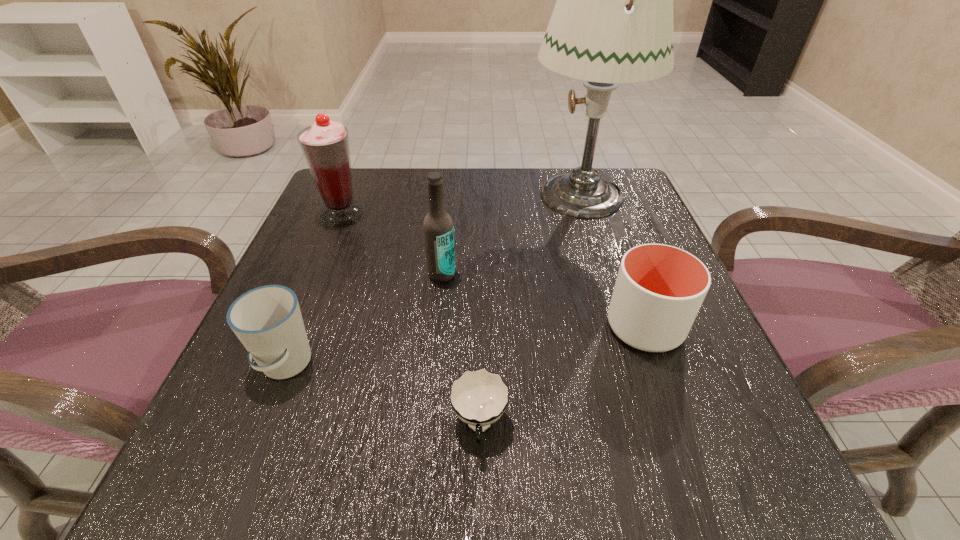
Identify which object is located as the second nearest to the leftmost cup. Please provide its 2D coordinates. Your answer should be formatted as a tuple, i.e. [(x, y)], where the tuple contains the x and y coordinates of a point satisfying the conditions above.

[(479, 397)]

The image size is (960, 540). Identify the location of cup that stands as the closest to the shortest cup. (659, 289).

Where is `cup that is the second closest to the shortest object`? This screenshot has width=960, height=540. cup that is the second closest to the shortest object is located at coordinates (267, 320).

Find the location of a particular element. free space that satisfies the following two spatial constraints: 1. on the lampshade of the tallest object; 2. on the back side of the rightmost cup is located at coordinates (624, 327).

Find the location of `vacant space that satisfies the following two spatial constraints: 1. on the lampshade of the tallest object; 2. on the side of the shortest cup with the handle`. vacant space that satisfies the following two spatial constraints: 1. on the lampshade of the tallest object; 2. on the side of the shortest cup with the handle is located at coordinates (656, 426).

Identify the location of free space that satisfies the following two spatial constraints: 1. on the lampshade of the rightmost cup; 2. on the right side of the lampshade. (624, 327).

Where is `vacant position in the image that satisfies the following two spatial constraints: 1. on the lampshade of the tallest object; 2. on the side of the third object from left to right with the label`? Image resolution: width=960 pixels, height=540 pixels. vacant position in the image that satisfies the following two spatial constraints: 1. on the lampshade of the tallest object; 2. on the side of the third object from left to right with the label is located at coordinates (607, 274).

The image size is (960, 540). I want to click on blank area in the image that satisfies the following two spatial constraints: 1. on the lampshade of the lampshade; 2. on the back side of the rightmost cup, so click(x=624, y=327).

Image resolution: width=960 pixels, height=540 pixels. What are the coordinates of `free space that satisfies the following two spatial constraints: 1. on the lampshade of the tallest object; 2. on the side of the shortest object with the handle` in the screenshot? It's located at (656, 426).